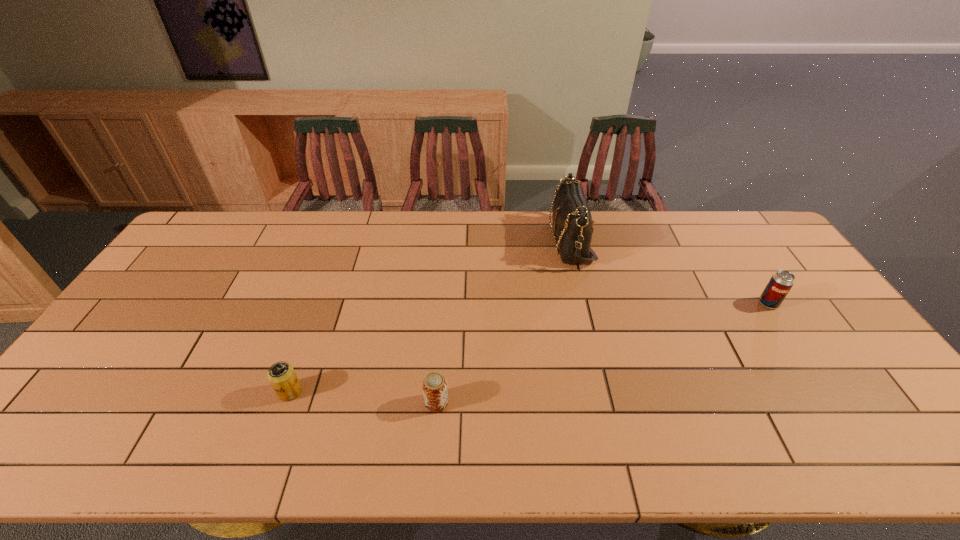
Find the location of `object that is the third closest one to the leftmost object`. object that is the third closest one to the leftmost object is located at coordinates click(781, 282).

Identify which object is the second nearest to the leftmost beer can. Please provide its 2D coordinates. Your answer should be formatted as a tuple, i.e. [(x, y)], where the tuple contains the x and y coordinates of a point satisfying the conditions above.

[(572, 220)]

Find the location of `beer can that is the nearest to the rightmost object`. beer can that is the nearest to the rightmost object is located at coordinates (434, 385).

Where is `beer can that stands as the second closest to the farthest beer can`? Image resolution: width=960 pixels, height=540 pixels. beer can that stands as the second closest to the farthest beer can is located at coordinates (281, 375).

Locate an element on the screen. free space in the image that satisfies the following two spatial constraints: 1. on the back side of the rightmost object; 2. on the left side of the leftmost beer can is located at coordinates (322, 303).

Where is `vacant region that satisfies the following two spatial constraints: 1. at the front of the second object from right to left with chain and zipper; 2. on the front side of the leftmost beer can`? Image resolution: width=960 pixels, height=540 pixels. vacant region that satisfies the following two spatial constraints: 1. at the front of the second object from right to left with chain and zipper; 2. on the front side of the leftmost beer can is located at coordinates (607, 392).

Where is `free region that satisfies the following two spatial constraints: 1. at the front of the tallest object with chain and zipper; 2. on the left side of the third nearest object`? free region that satisfies the following two spatial constraints: 1. at the front of the tallest object with chain and zipper; 2. on the left side of the third nearest object is located at coordinates coord(586,303).

In order to click on free space that satisfies the following two spatial constraints: 1. at the front of the handbag with chain and zipper; 2. on the front side of the leftmost object in this screenshot , I will do `click(607, 392)`.